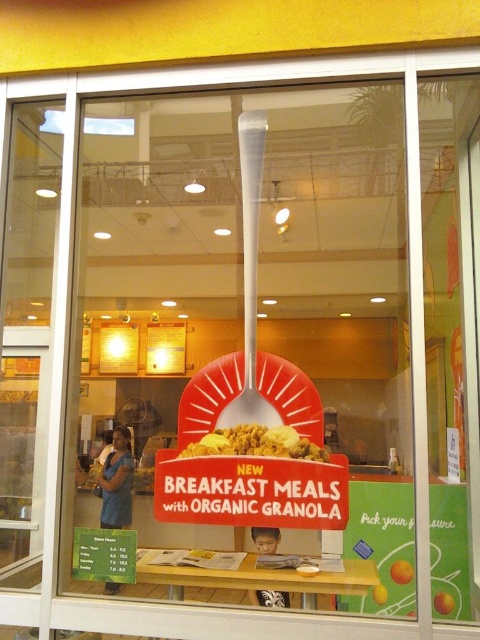
Question: Can you confirm if white plastic shovel at center is thinner than yellow matte cereal bowl at center?

Choices:
 (A) yes
 (B) no

Answer: (A)

Question: Which point is closer to the camera?

Choices:
 (A) (261, 132)
 (B) (237, 433)

Answer: (B)

Question: Which of the following is the closest to the observer?

Choices:
 (A) yellow matte cereal bowl at center
 (B) white plastic shovel at center

Answer: (A)

Question: Does white plastic shovel at center have a smaller size compared to yellow matte cereal bowl at center?

Choices:
 (A) no
 (B) yes

Answer: (A)

Question: Where is white plastic shovel at center located in relation to yellow matte cereal bowl at center in the image?

Choices:
 (A) above
 (B) below

Answer: (A)